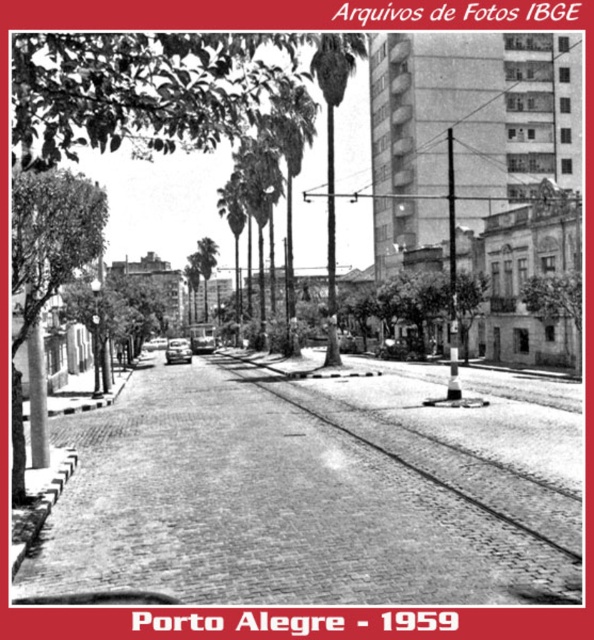
Question: Does cobblestone train track at center have a smaller size compared to shiny silver car at center?

Choices:
 (A) yes
 (B) no

Answer: (B)

Question: Which point appears farthest from the camera in this image?

Choices:
 (A) (503, 513)
 (B) (169, 342)

Answer: (B)

Question: Does cobblestone train track at center appear on the right side of shiny silver car at center?

Choices:
 (A) yes
 (B) no

Answer: (A)

Question: Does cobblestone train track at center appear on the right side of shiny silver car at center?

Choices:
 (A) yes
 (B) no

Answer: (A)

Question: Which object appears farthest from the camera in this image?

Choices:
 (A) shiny silver car at center
 (B) cobblestone train track at center

Answer: (A)